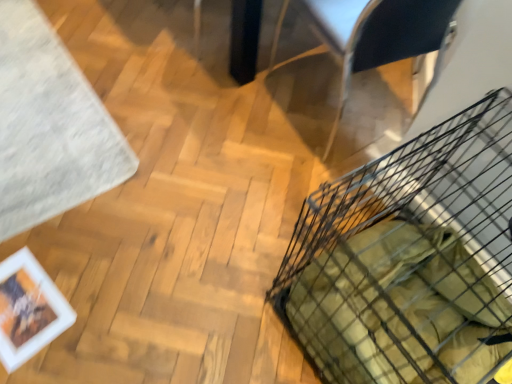
Question: Is metallic silver armchair at upper right bigger than black wire basket at lower right?

Choices:
 (A) no
 (B) yes

Answer: (A)

Question: Is metallic silver armchair at upper right smaller than black wire basket at lower right?

Choices:
 (A) yes
 (B) no

Answer: (A)

Question: From the image's perspective, is metallic silver armchair at upper right on black wire basket at lower right?

Choices:
 (A) yes
 (B) no

Answer: (A)

Question: Can we say metallic silver armchair at upper right lies outside black wire basket at lower right?

Choices:
 (A) no
 (B) yes

Answer: (B)

Question: Is metallic silver armchair at upper right at the left side of black wire basket at lower right?

Choices:
 (A) yes
 (B) no

Answer: (A)

Question: Is point (374, 59) closer or farther from the camera than point (41, 329)?

Choices:
 (A) closer
 (B) farther

Answer: (B)

Question: In terms of width, does metallic silver armchair at upper right look wider or thinner when compared to white matte picture frame at lower left?

Choices:
 (A) wide
 (B) thin

Answer: (A)

Question: From a real-world perspective, relative to white matte picture frame at lower left, is metallic silver armchair at upper right vertically above or below?

Choices:
 (A) below
 (B) above

Answer: (B)

Question: From the image's perspective, is metallic silver armchair at upper right positioned above or below white matte picture frame at lower left?

Choices:
 (A) below
 (B) above

Answer: (B)

Question: From a real-world perspective, is white soft rug at upper left above or below black wire basket at lower right?

Choices:
 (A) above
 (B) below

Answer: (B)

Question: From the image's perspective, is white soft rug at upper left located above or below black wire basket at lower right?

Choices:
 (A) above
 (B) below

Answer: (A)

Question: Based on their sizes in the image, would you say white soft rug at upper left is bigger or smaller than black wire basket at lower right?

Choices:
 (A) small
 (B) big

Answer: (A)

Question: Choose the correct answer: Is white soft rug at upper left inside black wire basket at lower right or outside it?

Choices:
 (A) inside
 (B) outside

Answer: (B)

Question: From a real-world perspective, is black wire basket at lower right physically located above or below metallic silver armchair at upper right?

Choices:
 (A) above
 (B) below

Answer: (B)

Question: From the image's perspective, is black wire basket at lower right positioned above or below metallic silver armchair at upper right?

Choices:
 (A) below
 (B) above

Answer: (A)